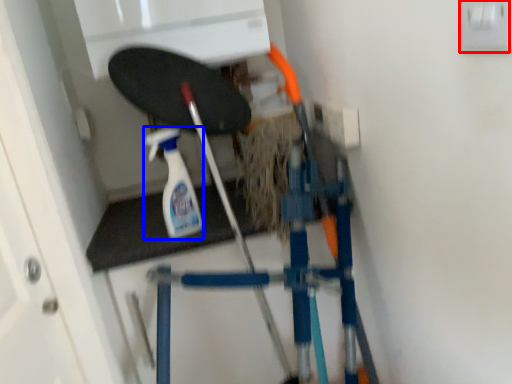
Question: Among these objects, which one is nearest to the camera, electric outlet (highlighted by a red box) or cleaning product (highlighted by a blue box)?

Choices:
 (A) electric outlet
 (B) cleaning product

Answer: (A)